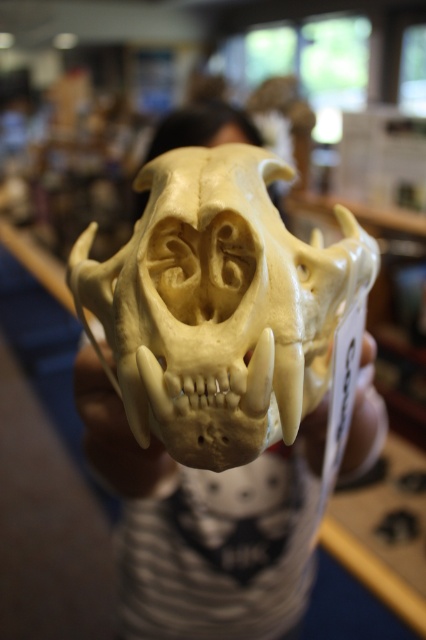
Question: Does white bone hand at center appear under white bone skull at center?

Choices:
 (A) yes
 (B) no

Answer: (B)

Question: Which point is farther to the camera?

Choices:
 (A) white bone skull at center
 (B) ivory bone skull at center
 (C) white bone hand at center

Answer: (A)

Question: Among these objects, which one is nearest to the camera?

Choices:
 (A) white bone hand at center
 (B) white bone skull at center

Answer: (A)

Question: Can you confirm if ivory bone skull at center is positioned to the left of white bone skull at center?

Choices:
 (A) yes
 (B) no

Answer: (A)

Question: Is ivory bone skull at center wider than white bone hand at center?

Choices:
 (A) yes
 (B) no

Answer: (A)

Question: Which point appears farthest from the camera in this image?

Choices:
 (A) (374, 353)
 (B) (115, 458)

Answer: (B)